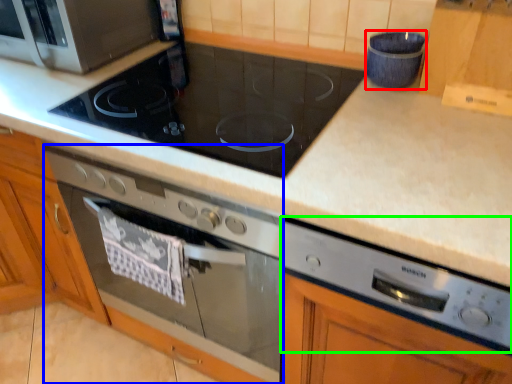
Question: Considering the real-world distances, which object is closest to appliance (highlighted by a red box)? home appliance (highlighted by a blue box) or appliance (highlighted by a green box).

Choices:
 (A) home appliance
 (B) appliance

Answer: (B)